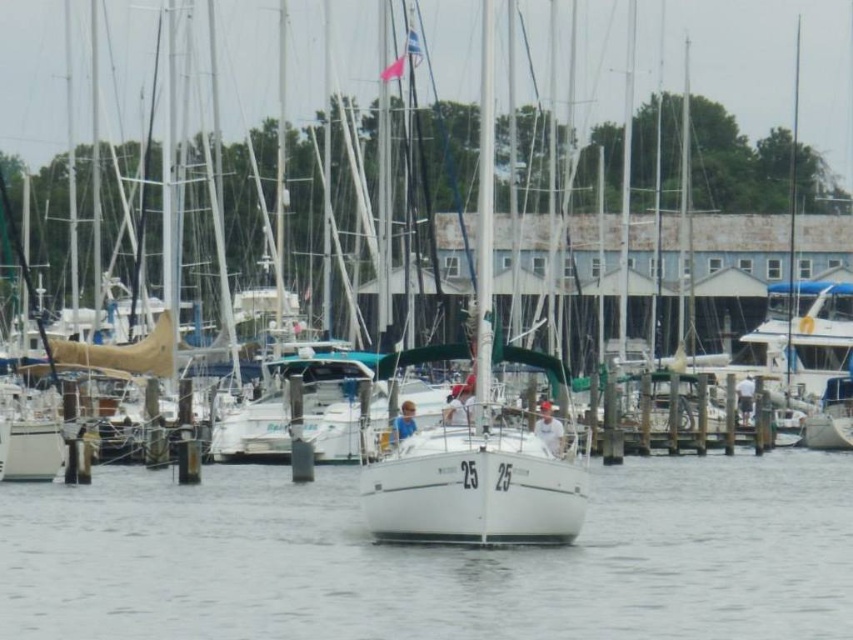
Question: Can you confirm if white smooth water at center is positioned to the left of white matte sailboat at center?

Choices:
 (A) yes
 (B) no

Answer: (A)

Question: Which of the following is the farthest from the observer?

Choices:
 (A) white matte sailboat at center
 (B) white smooth water at center

Answer: (A)

Question: Is white smooth water at center closer to camera compared to white matte sailboat at center?

Choices:
 (A) no
 (B) yes

Answer: (B)

Question: Does white smooth water at center appear under white matte sailboat at center?

Choices:
 (A) yes
 (B) no

Answer: (A)